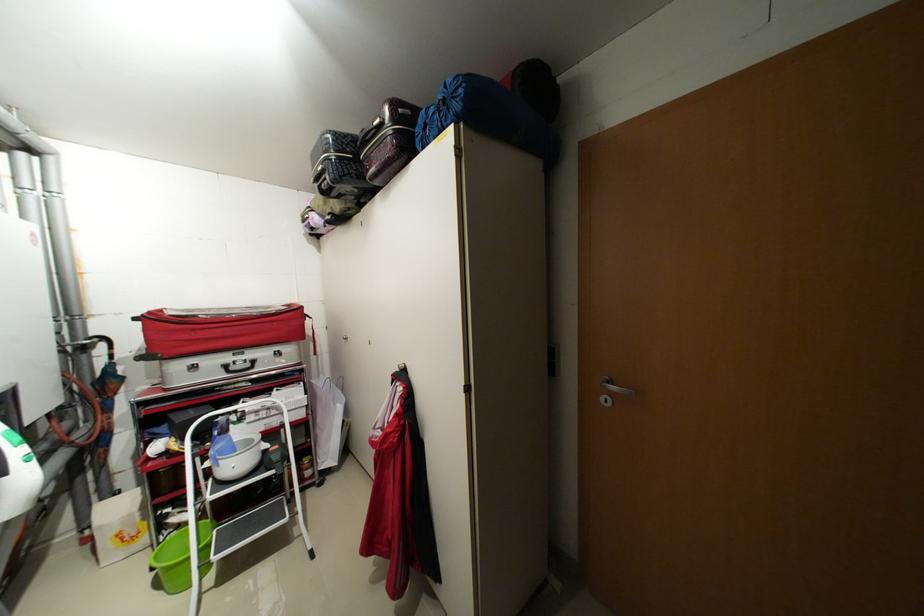
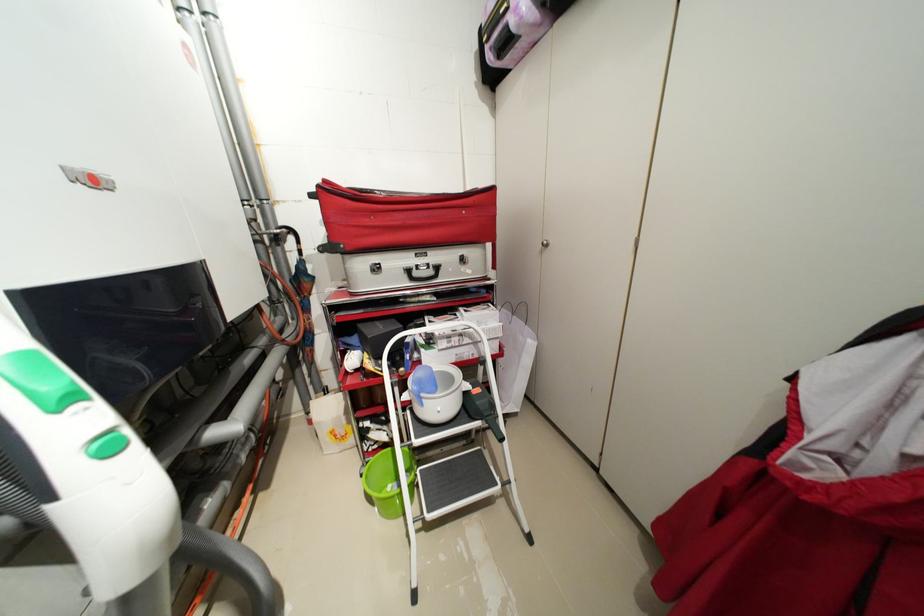
Where in the second image is the point corresponding to (214,464) from the first image?

(412, 398)